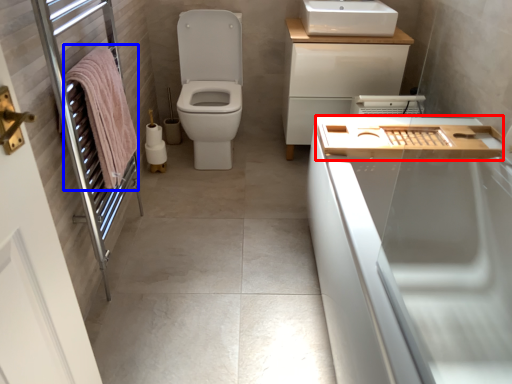
Question: Which object is further to the camera taking this photo, counter top (highlighted by a red box) or bath towel (highlighted by a blue box)?

Choices:
 (A) counter top
 (B) bath towel

Answer: (A)